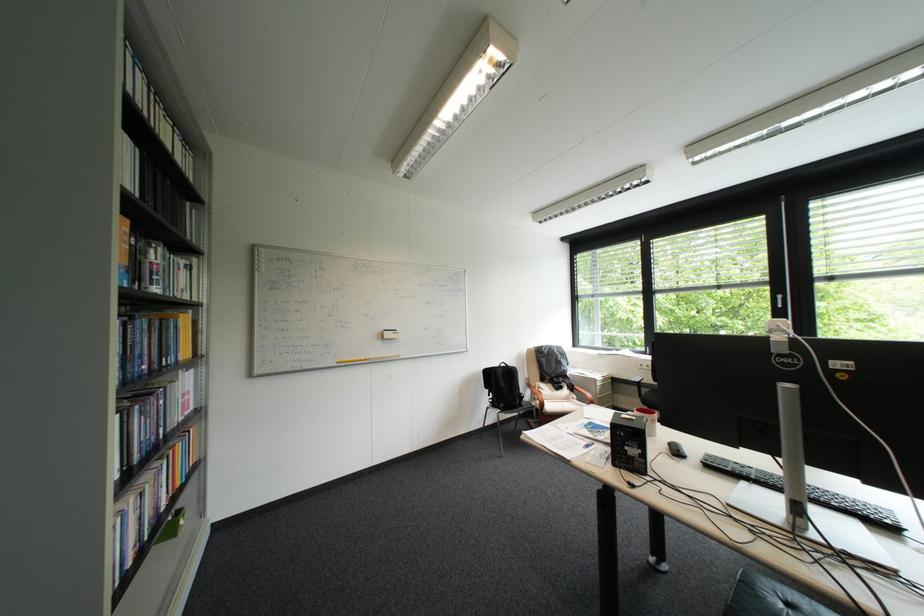
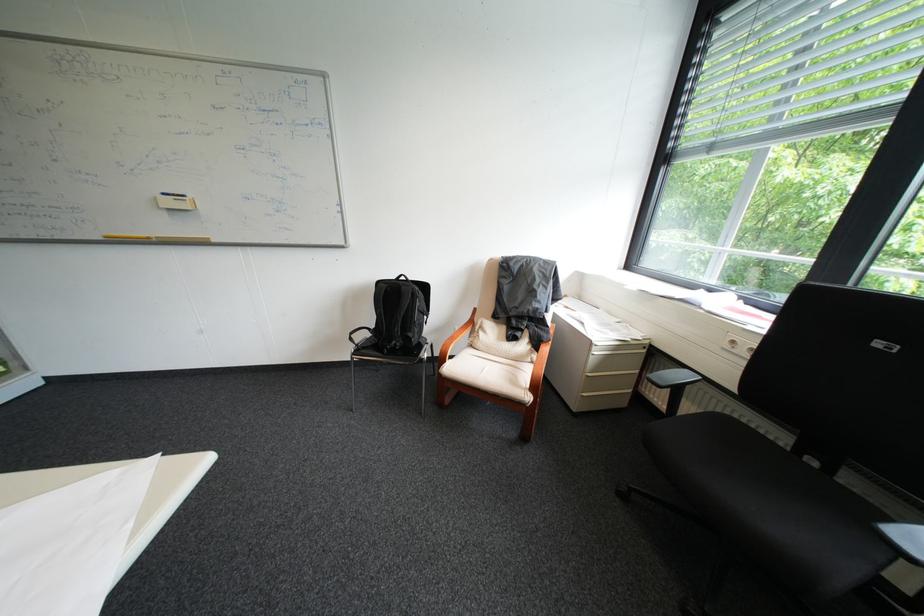
Where in the second image is the point corresponding to pixel 524 369 from the first image?

(415, 288)